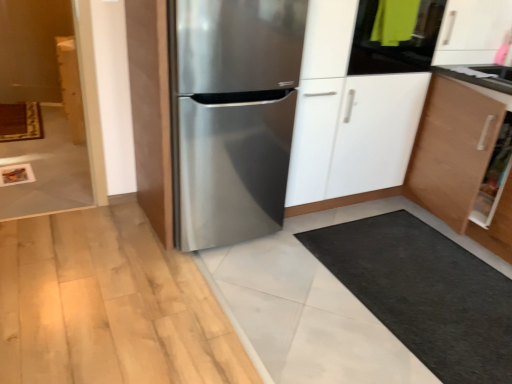
Question: From the image's perspective, relative to wooden cabinet at left, is stainless steel refrigerator at center above or below?

Choices:
 (A) below
 (B) above

Answer: (A)

Question: Is stainless steel refrigerator at center to the left or to the right of wooden cabinet at left in the image?

Choices:
 (A) right
 (B) left

Answer: (A)

Question: Considering the real-world distances, which object is closest to the white glossy countertop at upper right?

Choices:
 (A) wooden cabinet at left
 (B) stainless steel refrigerator at center
 (C) stainless steel refrigerator at center

Answer: (B)

Question: Which is farther from the wooden cabinet at left?

Choices:
 (A) white glossy countertop at upper right
 (B) stainless steel refrigerator at center
 (C) stainless steel refrigerator at center

Answer: (A)